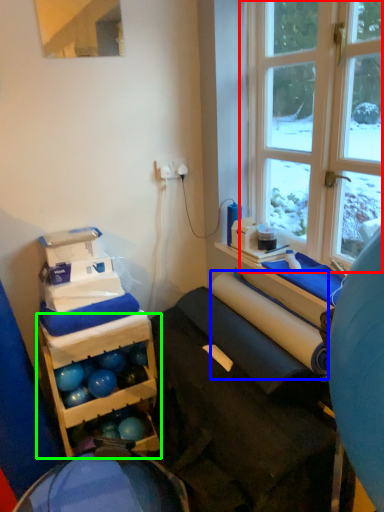
Question: Which is nearer to the window (highlighted by a red box)? paper towel (highlighted by a blue box) or shelf (highlighted by a green box).

Choices:
 (A) paper towel
 (B) shelf

Answer: (A)